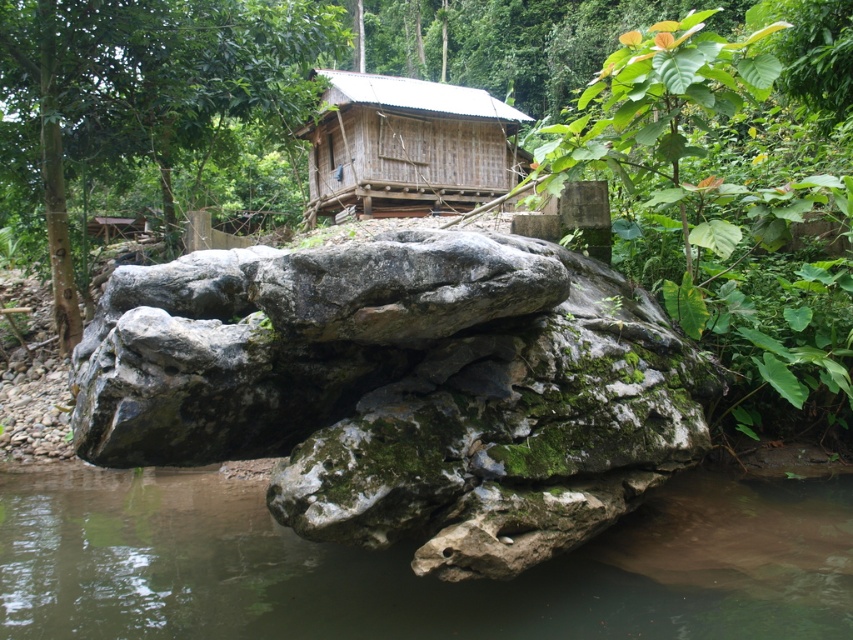
Is green mossy rock at lower center above wooden cabin at center?

Incorrect, green mossy rock at lower center is not positioned above wooden cabin at center.

Is point (248, 624) in front of point (337, 72)?

Yes, it is in front of point (337, 72).

I want to click on green mossy rock at lower center, so click(x=409, y=566).

Does mossy stone rock at center appear under green mossy rock at lower center?

Actually, mossy stone rock at center is above green mossy rock at lower center.

Is point (282, 328) positioned behind point (828, 532)?

No, it is in front of (828, 532).

I want to click on mossy stone rock at center, so click(x=410, y=394).

Which is in front, point (216, 374) or point (352, 100)?

Point (216, 374)

Which is below, mossy stone rock at center or wooden cabin at center?

mossy stone rock at center

This screenshot has width=853, height=640. Describe the element at coordinates (410, 394) in the screenshot. I see `mossy stone rock at center` at that location.

I want to click on mossy stone rock at center, so click(x=410, y=394).